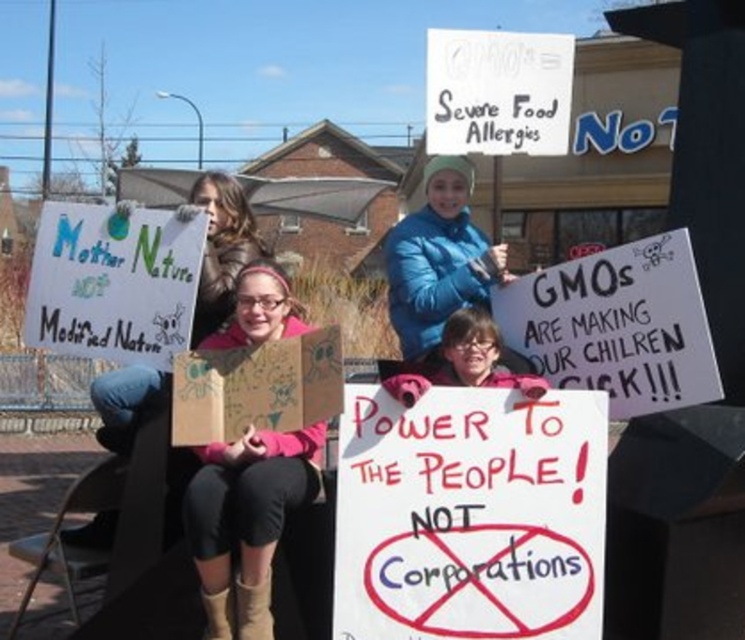
Can you confirm if white paper sign at center is bigger than pink fabric shirt at center?

No.

From the picture: Can you confirm if white paper sign at center is positioned above pink fabric shirt at center?

Indeed, white paper sign at center is positioned over pink fabric shirt at center.

You are a GUI agent. You are given a task and a screenshot of the screen. Output one action in this format:
    pyautogui.click(x=<x>, y=<y>)
    Task: Click on the white paper sign at center
    
    Given the screenshot: What is the action you would take?
    pyautogui.click(x=469, y=515)

Find the location of `white paper sign at center`. white paper sign at center is located at coordinates (469, 515).

Does white cardboard sign at center have a larger size compared to metallic folding chair at lower left?

No.

Between white cardboard sign at center and metallic folding chair at lower left, which one appears on the left side from the viewer's perspective?

From the viewer's perspective, metallic folding chair at lower left appears more on the left side.

The width and height of the screenshot is (745, 640). What do you see at coordinates (112, 282) in the screenshot?
I see `white cardboard sign at center` at bounding box center [112, 282].

At what (x,y) coordinates should I click in order to perform the action: click on white cardboard sign at center. Please return your answer as a coordinate pair (x, y). The image size is (745, 640). Looking at the image, I should click on (112, 282).

In the scene shown: Which is above, white paper sign at center or blue puffy jacket at center?

blue puffy jacket at center is above.

Can you confirm if white paper sign at center is taller than blue puffy jacket at center?

Incorrect, white paper sign at center's height is not larger of blue puffy jacket at center's.

Does point (570, 538) come farther from viewer compared to point (440, 326)?

No.

You are a GUI agent. You are given a task and a screenshot of the screen. Output one action in this format:
    pyautogui.click(x=<x>, y=<y>)
    Task: Click on the white paper sign at center
    This screenshot has height=640, width=745.
    Given the screenshot: What is the action you would take?
    coord(469,515)